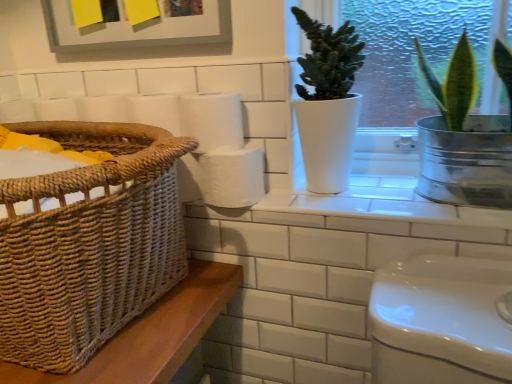
Question: Is white matte toilet paper at center facing away from woven brown basket at left?

Choices:
 (A) no
 (B) yes

Answer: (A)

Question: Can you confirm if white matte toilet paper at center is shorter than woven brown basket at left?

Choices:
 (A) no
 (B) yes

Answer: (B)

Question: From a real-world perspective, is white matte toilet paper at center below woven brown basket at left?

Choices:
 (A) no
 (B) yes

Answer: (B)

Question: From the image's perspective, is white matte toilet paper at center located beneath woven brown basket at left?

Choices:
 (A) no
 (B) yes

Answer: (A)

Question: Is woven brown basket at left located within white matte toilet paper at center?

Choices:
 (A) yes
 (B) no

Answer: (B)

Question: In terms of width, does metallic silver pot at upper right, which is counted as the second houseplant, starting from the left, look wider or thinner when compared to white ceramic window sill at upper center?

Choices:
 (A) thin
 (B) wide

Answer: (A)

Question: Is metallic silver pot at upper right, which is counted as the second houseplant, starting from the left, to the left or to the right of white ceramic window sill at upper center in the image?

Choices:
 (A) left
 (B) right

Answer: (B)

Question: Is metallic silver pot at upper right, which is counted as the second houseplant, starting from the left, in front of or behind white ceramic window sill at upper center in the image?

Choices:
 (A) front
 (B) behind

Answer: (A)

Question: Is point (485, 193) closer or farther from the camera than point (400, 177)?

Choices:
 (A) closer
 (B) farther

Answer: (A)

Question: In terms of width, does woven brown basket at left look wider or thinner when compared to white ceramic window sill at upper center?

Choices:
 (A) thin
 (B) wide

Answer: (B)

Question: Based on their sizes in the image, would you say woven brown basket at left is bigger or smaller than white ceramic window sill at upper center?

Choices:
 (A) big
 (B) small

Answer: (A)

Question: Do you think woven brown basket at left is within white ceramic window sill at upper center, or outside of it?

Choices:
 (A) inside
 (B) outside

Answer: (B)

Question: Considering the positions of point (61, 271) and point (369, 190), is point (61, 271) closer or farther from the camera than point (369, 190)?

Choices:
 (A) farther
 (B) closer

Answer: (B)

Question: Based on their sizes in the image, would you say white matte pot at center, the 1th houseplant viewed from the left, is bigger or smaller than white matte toilet paper at center?

Choices:
 (A) small
 (B) big

Answer: (B)

Question: Relative to white matte toilet paper at center, is white matte pot at center, the second houseplant positioned from the right, in front or behind?

Choices:
 (A) behind
 (B) front

Answer: (B)